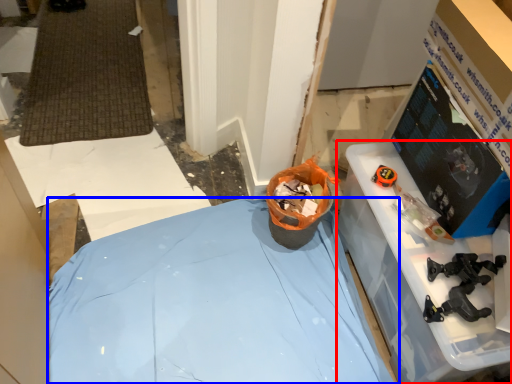
Question: Which point is closer to the camera, furniture (highlighted by a red box) or furniture (highlighted by a blue box)?

Choices:
 (A) furniture
 (B) furniture

Answer: (A)